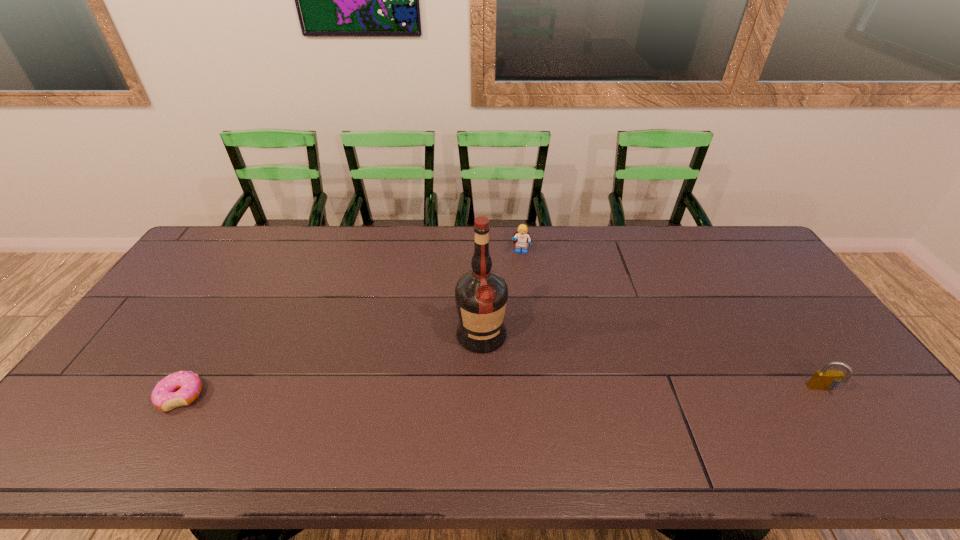
Where is `vacant region at the far edge of the desktop`? The width and height of the screenshot is (960, 540). vacant region at the far edge of the desktop is located at coordinates (660, 264).

This screenshot has width=960, height=540. In the image, there is a desktop. What are the coordinates of `vacant space at the near edge` in the screenshot? It's located at (240, 403).

In the image, there is a desktop. Where is `vacant region at the left edge`? The height and width of the screenshot is (540, 960). vacant region at the left edge is located at coordinates (211, 296).

In the image, there is a desktop. At what (x,y) coordinates should I click in order to perform the action: click on vacant area at the right edge. Please return your answer as a coordinate pair (x, y). Image resolution: width=960 pixels, height=540 pixels. Looking at the image, I should click on (778, 289).

What are the coordinates of `free space at the far left corner of the desktop` in the screenshot? It's located at (227, 255).

This screenshot has height=540, width=960. Find the location of `vacant space at the far right corner`. vacant space at the far right corner is located at coordinates (702, 230).

This screenshot has width=960, height=540. In the image, there is a desktop. What are the coordinates of `blank space at the near right corner` in the screenshot? It's located at (819, 404).

Find the location of a particular element. The width and height of the screenshot is (960, 540). vacant space in between the padlock and the liquor is located at coordinates (652, 362).

Locate an element on the screen. This screenshot has width=960, height=540. free spot between the Lego and the doughnut is located at coordinates (351, 324).

The height and width of the screenshot is (540, 960). I want to click on vacant space that's between the padlock and the leftmost object, so click(502, 393).